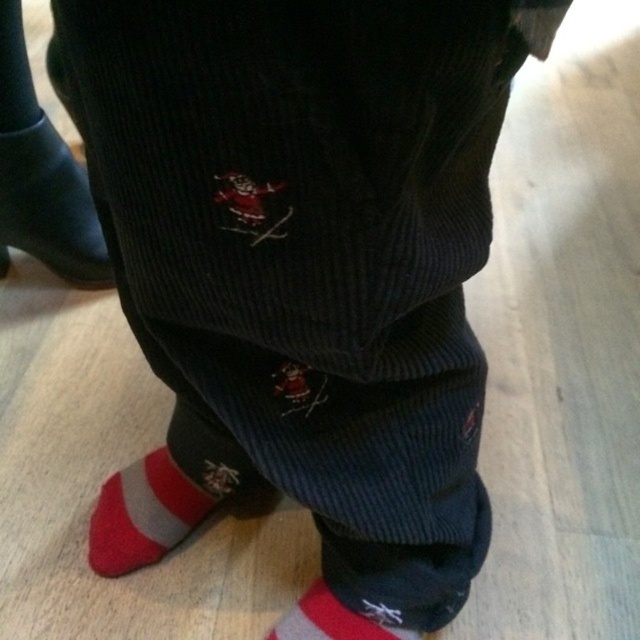
Looking at this image, does matte black pants at center have a lesser width compared to red cotton sock at lower center?

No, matte black pants at center is not thinner than red cotton sock at lower center.

Can you confirm if matte black pants at center is positioned below red cotton sock at lower center?

No.

What do you see at coordinates (49, 205) in the screenshot? I see `matte black pants at center` at bounding box center [49, 205].

The image size is (640, 640). In order to click on matte black pants at center in this screenshot , I will do `click(49, 205)`.

The width and height of the screenshot is (640, 640). Find the location of `red cotton sock at lower left`. red cotton sock at lower left is located at coordinates (144, 515).

Can you confirm if red cotton sock at lower left is shorter than red cotton sock at lower center?

Incorrect, red cotton sock at lower left's height does not fall short of red cotton sock at lower center's.

What do you see at coordinates (144, 515) in the screenshot? I see `red cotton sock at lower left` at bounding box center [144, 515].

Image resolution: width=640 pixels, height=640 pixels. What are the coordinates of `red cotton sock at lower left` in the screenshot? It's located at (144, 515).

Can you confirm if matte black pants at center is wider than red cotton sock at lower left?

Yes.

Which of these two, matte black pants at center or red cotton sock at lower left, stands shorter?

red cotton sock at lower left is shorter.

This screenshot has width=640, height=640. Describe the element at coordinates (49, 205) in the screenshot. I see `matte black pants at center` at that location.

In order to click on matte black pants at center in this screenshot , I will do `click(49, 205)`.